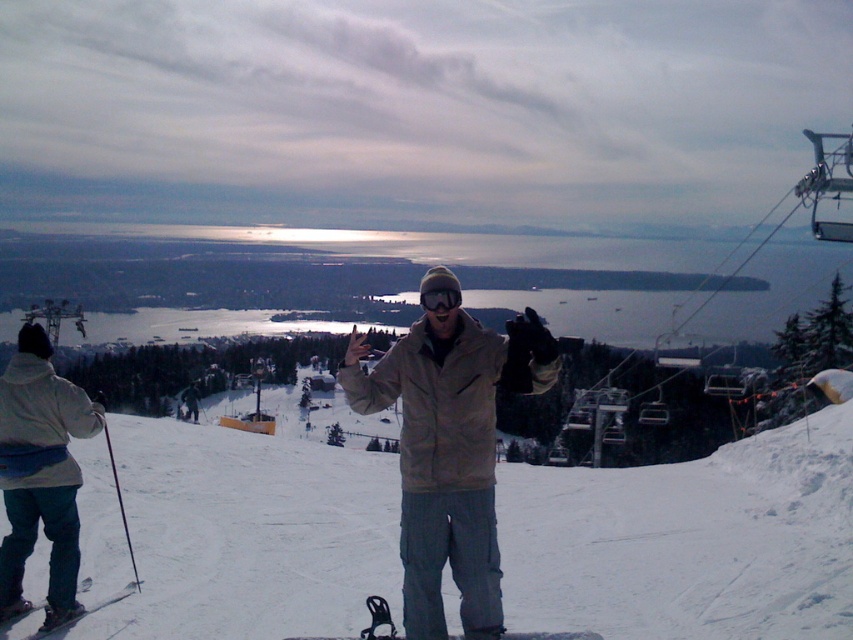
Who is positioned more to the left, black matte goggles at center or black matte ski at lower left?

From the viewer's perspective, black matte ski at lower left appears more on the left side.

Is black matte goggles at center closer to camera compared to black matte ski at lower left?

Yes, it is in front of black matte ski at lower left.

Where is `black matte goggles at center`? This screenshot has height=640, width=853. black matte goggles at center is located at coordinates (440, 298).

Describe the element at coordinates (39, 474) in the screenshot. The width and height of the screenshot is (853, 640). I see `white fleece jacket at lower left` at that location.

Who is higher up, white fleece jacket at lower left or black matte snowboard at center?

white fleece jacket at lower left

Who is more forward, (10, 545) or (538, 632)?

Positioned in front is point (538, 632).

At what (x,y) coordinates should I click in order to perform the action: click on white fleece jacket at lower left. Please return your answer as a coordinate pair (x, y). Looking at the image, I should click on (39, 474).

Between point (32, 512) and point (125, 588), which one is positioned behind?

The point (125, 588) is more distant.

Is point (44, 419) closer to camera compared to point (65, 625)?

Yes, point (44, 419) is in front of point (65, 625).

The width and height of the screenshot is (853, 640). What do you see at coordinates (39, 474) in the screenshot?
I see `white fleece jacket at lower left` at bounding box center [39, 474].

Locate an element on the screen. The width and height of the screenshot is (853, 640). white fleece jacket at lower left is located at coordinates (39, 474).